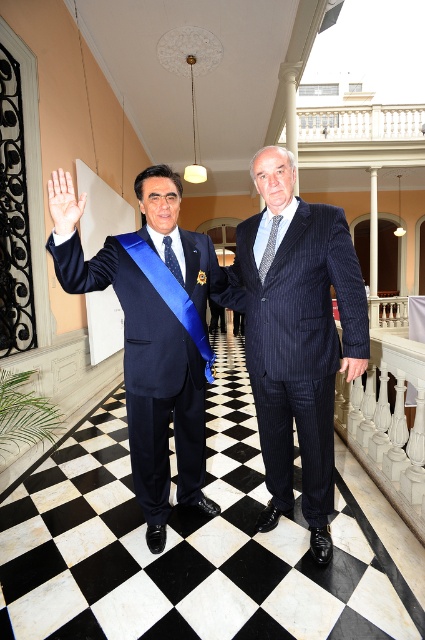
You are a photographer at a formal event and need to ensure that both the dark blue pinstripe suit at center and the patterned silk tie at center are visible in your photo. Given their sizes, which one might require you to adjust your camera angle to capture fully?

The dark blue pinstripe suit at center is much taller than the patterned silk tie at center, so you might need to adjust your camera angle to capture the full height of the dark blue pinstripe suit at center.

What is located at the coordinates point (x=269, y=248) in the image?

The point (x=269, y=248) marks the patterned silk tie at center.